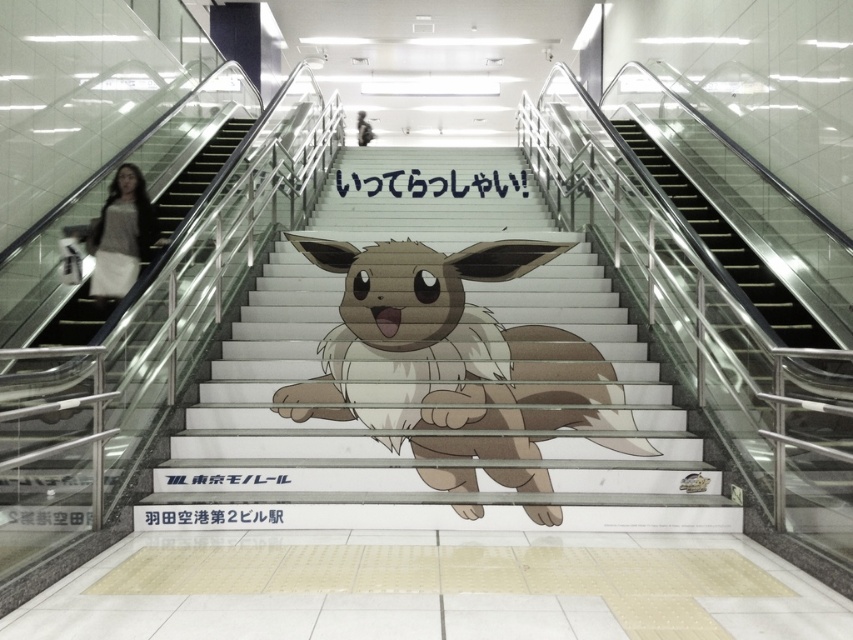
Question: Does brown furry creature at center appear over light brown sweater at left?

Choices:
 (A) yes
 (B) no

Answer: (B)

Question: Which object is positioned closest to the brown furry stairs at center?

Choices:
 (A) smooth skin person at center
 (B) brown furry creature at center

Answer: (B)

Question: Is brown furry stairs at center bigger than brown furry creature at center?

Choices:
 (A) no
 (B) yes

Answer: (A)

Question: Estimate the real-world distances between objects in this image. Which object is closer to the brown furry stairs at center?

Choices:
 (A) brown furry creature at center
 (B) light brown sweater at left
 (C) smooth skin person at center

Answer: (A)

Question: Which of these objects is positioned farthest from the brown furry creature at center?

Choices:
 (A) light brown sweater at left
 (B) brown furry stairs at center
 (C) smooth skin person at center

Answer: (C)

Question: Is brown furry creature at center wider than smooth skin person at center?

Choices:
 (A) yes
 (B) no

Answer: (A)